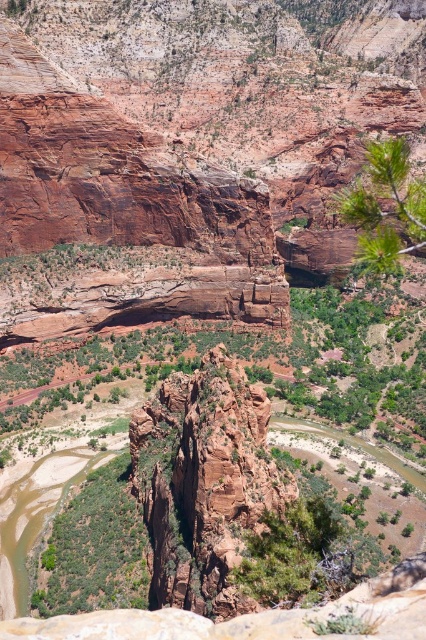
Between green leafy shrubs at center and green leafy branch at upper right, which one appears on the left side from the viewer's perspective?

green leafy shrubs at center is more to the left.

Is green leafy shrubs at center below green leafy branch at upper right?

Indeed, green leafy shrubs at center is positioned under green leafy branch at upper right.

Identify the location of green leafy shrubs at center. 94,548.

Is rustic sandstone cliff at center in front of green leafy branch at upper right?

Yes, it is in front of green leafy branch at upper right.

Which is more to the left, rustic sandstone cliff at center or green leafy branch at upper right?

rustic sandstone cliff at center

Which is in front, point (215, 516) or point (425, 220)?

Point (215, 516)

The width and height of the screenshot is (426, 640). Find the location of `rustic sandstone cliff at center`. rustic sandstone cliff at center is located at coordinates (204, 483).

Find the location of a particular element. The height and width of the screenshot is (640, 426). rustic sandstone cliff at center is located at coordinates (204, 483).

Is point (141, 416) positioned before point (131, 605)?

No, it is behind (131, 605).

Find the location of a particular element. rustic sandstone cliff at center is located at coordinates (204, 483).